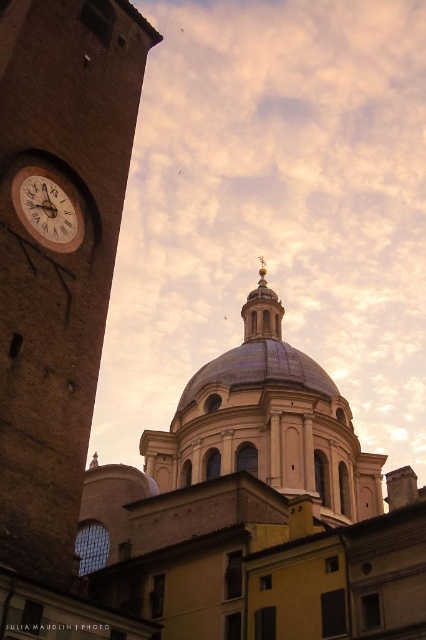
From the picture: You are standing at a point 112.75 feet away from the camera. Based on the scene description, which object or feature is located at the coordinates point (14,120)?

The coordinates point (14,120) corresponds to the position of the camera, as the distance between them is 112.75 feet.

You are an architect evaluating the structural stability of the brick tower at left and the wooden clock face at upper left. Based on their relative sizes, which object might require more reinforcement to withstand strong winds?

The brick tower at left might require more reinforcement to withstand strong winds because it is wider than the wooden clock face at upper left, making it more susceptible to wind forces.

You are an architect analyzing the layout of this building. Based on the scene, which object is located below the other between the brick tower at left and the wooden clock face at upper left?

The brick tower at left is positioned under the wooden clock face at upper left, meaning the tower is below the clock face.